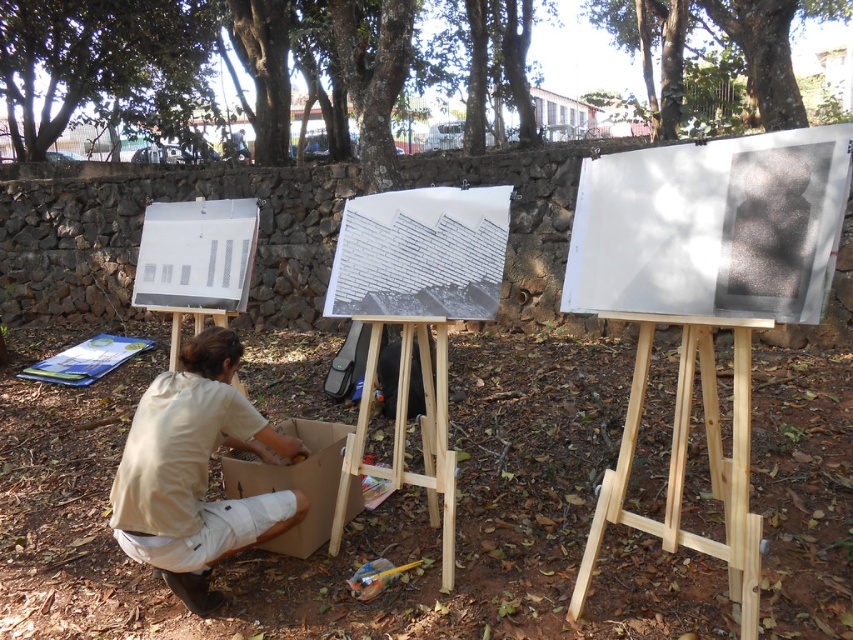
You are an artist standing in front of the cardboard box at lower center and looking towards the green leafy tree at upper center. Which object appears narrower from your perspective?

The green leafy tree at upper center appears narrower than the cardboard box at lower center because it is thinner.

What is the 2D coordinate of the brown textured tree at upper center?

The brown textured tree at upper center is located at the 2D coordinate point of (137, 60).